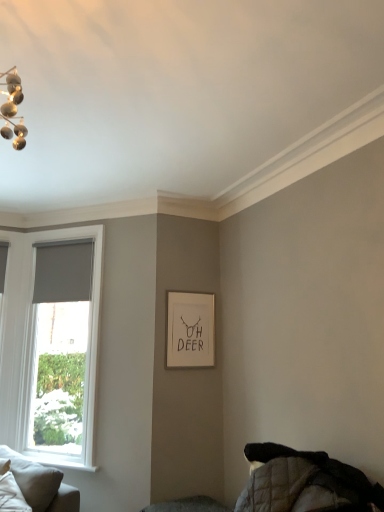
The width and height of the screenshot is (384, 512). What do you see at coordinates (190, 330) in the screenshot?
I see `white matte picture frame at center` at bounding box center [190, 330].

Measure the distance between light gray fabric couch at lower left and camera.

light gray fabric couch at lower left and camera are 3.16 meters apart from each other.

What is the approximate width of light gray fabric couch at lower left?

The width of light gray fabric couch at lower left is 17.49 inches.

Locate an element on the screen. matte gray curtain at left is located at coordinates (63, 272).

Considering the sizes of objects light gray fabric couch at lower left and white matte picture frame at center in the image provided, who is smaller, light gray fabric couch at lower left or white matte picture frame at center?

With smaller size is white matte picture frame at center.

Considering the sizes of objects light gray fabric couch at lower left and white matte picture frame at center in the image provided, who is wider, light gray fabric couch at lower left or white matte picture frame at center?

light gray fabric couch at lower left is wider.

From the image's perspective, does light gray fabric couch at lower left appear higher than white matte picture frame at center?

Actually, light gray fabric couch at lower left appears below white matte picture frame at center in the image.

Is light gray fabric couch at lower left not within white matte picture frame at center?

Yes, light gray fabric couch at lower left is not within white matte picture frame at center.

Is white soft pillow at lower left directly adjacent to light gray fabric couch at lower left?

white soft pillow at lower left and light gray fabric couch at lower left are clearly separated.

Consider the image. Could light gray fabric couch at lower left be considered to be inside white soft pillow at lower left?

Actually, light gray fabric couch at lower left is outside white soft pillow at lower left.

Which of these two, white soft pillow at lower left or light gray fabric couch at lower left, is wider?

With larger width is light gray fabric couch at lower left.

Who is shorter, white matte picture frame at center or white soft pillow at lower left?

white soft pillow at lower left.

Which is closer, (192,315) or (21,497)?

Point (192,315) is positioned farther from the camera compared to point (21,497).

Is white matte picture frame at center not inside white soft pillow at lower left?

Yes.

How far apart are gray roller blind at left and matte gray curtain at left?

gray roller blind at left and matte gray curtain at left are 13.25 inches apart.

Considering the relative sizes of gray roller blind at left and matte gray curtain at left in the image provided, is gray roller blind at left shorter than matte gray curtain at left?

In fact, gray roller blind at left may be taller than matte gray curtain at left.

What's the angular difference between gray roller blind at left and matte gray curtain at left's facing directions?

gray roller blind at left and matte gray curtain at left are facing 1.77 degrees away from each other.

Does point (34, 422) appear closer or farther from the camera than point (69, 257)?

Point (34, 422) is closer to the camera than point (69, 257).

Can you tell me how much white soft pillow at lower left and white matte picture frame at center differ in facing direction?

The angle between the facing direction of white soft pillow at lower left and the facing direction of white matte picture frame at center is 56.8 degrees.

Is white soft pillow at lower left closer to camera compared to white matte picture frame at center?

Yes, it is in front of white matte picture frame at center.

Does white soft pillow at lower left turn towards white matte picture frame at center?

No, white soft pillow at lower left is not oriented towards white matte picture frame at center.

Is white soft pillow at lower left outside of white matte picture frame at center?

white soft pillow at lower left lies outside white matte picture frame at center's area.

From the image's perspective, which is above, matte gray curtain at left or white soft pillow at lower left?

matte gray curtain at left appears higher in the image.

Is matte gray curtain at left taller or shorter than white soft pillow at lower left?

In the image, matte gray curtain at left appears to be taller than white soft pillow at lower left.

Does matte gray curtain at left appear on the right side of white soft pillow at lower left?

Yes, matte gray curtain at left is to the right of white soft pillow at lower left.

What's the angular difference between gray roller blind at left and white matte picture frame at center's facing directions?

The angle between the facing direction of gray roller blind at left and the facing direction of white matte picture frame at center is 48.5 degrees.

Is white matte picture frame at center a part of gray roller blind at left?

Actually, white matte picture frame at center is outside gray roller blind at left.

Does point (80, 416) lie behind point (206, 298)?

Yes, it is.

Based on the photo, measure the distance between gray roller blind at left and white matte picture frame at center.

gray roller blind at left is 3.83 feet from white matte picture frame at center.

Image resolution: width=384 pixels, height=512 pixels. Identify the location of studio couch that appears on the left of white matte picture frame at center. (41, 484).

I want to click on studio couch on the right of white soft pillow at lower left, so point(41,484).

Looking at the image, which one is located closer to light gray fabric couch at lower left, matte gray curtain at left or white soft pillow at lower left?

white soft pillow at lower left is positioned closer to the anchor light gray fabric couch at lower left.

Estimate the real-world distances between objects in this image. Which object is further from white soft pillow at lower left, matte gray curtain at left or light gray fabric couch at lower left?

matte gray curtain at left.

Based on their spatial positions, is light gray fabric couch at lower left or matte gray curtain at left closer to gray roller blind at left?

matte gray curtain at left lies closer to gray roller blind at left than the other object.

Looking at the image, which one is located further to matte gray curtain at left, white soft pillow at lower left or gray roller blind at left?

white soft pillow at lower left lies further to matte gray curtain at left than the other object.

Considering their positions, is light gray fabric couch at lower left positioned closer to matte gray curtain at left than gray roller blind at left?

gray roller blind at left is closer to matte gray curtain at left.

Estimate the real-world distances between objects in this image. Which object is closer to white soft pillow at lower left, gray roller blind at left or white matte picture frame at center?

gray roller blind at left.

Looking at the image, which one is located closer to white matte picture frame at center, light gray fabric couch at lower left or white soft pillow at lower left?

The object closer to white matte picture frame at center is light gray fabric couch at lower left.

Looking at the image, which one is located closer to matte gray curtain at left, white matte picture frame at center or light gray fabric couch at lower left?

white matte picture frame at center is closer to matte gray curtain at left.

Locate an element on the screen. Image resolution: width=384 pixels, height=512 pixels. studio couch between white soft pillow at lower left and white matte picture frame at center is located at coordinates (41, 484).

At what (x,y) coordinates should I click in order to perform the action: click on window that lies between matte gray curtain at left and white soft pillow at lower left from top to bottom. Please return your answer as a coordinate pair (x, y). This screenshot has width=384, height=512. Looking at the image, I should click on (51, 344).

The image size is (384, 512). Find the location of `curtain located between white soft pillow at lower left and white matte picture frame at center in the left-right direction`. curtain located between white soft pillow at lower left and white matte picture frame at center in the left-right direction is located at coordinates (63, 272).

The image size is (384, 512). I want to click on window between light gray fabric couch at lower left and matte gray curtain at left from front to back, so click(x=51, y=344).